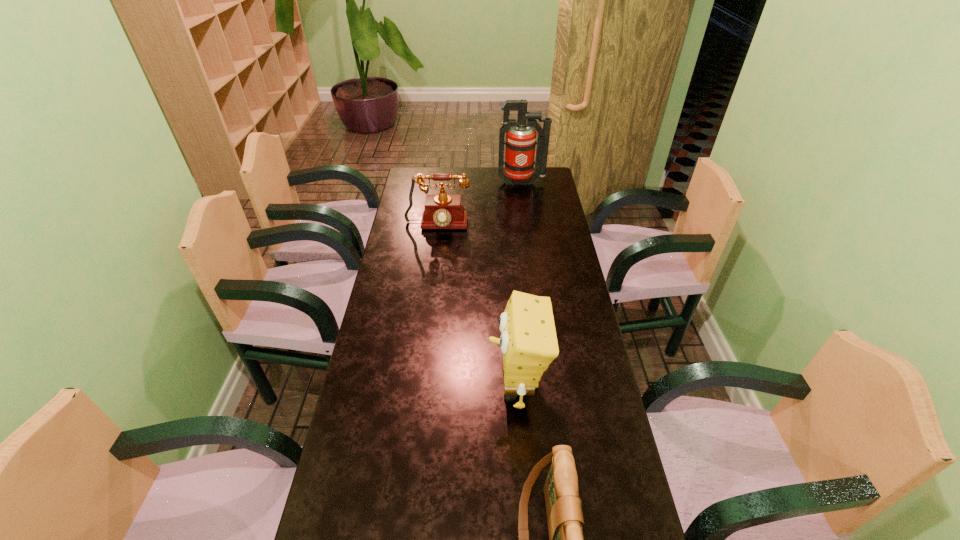
Where is `the farthest object`? Image resolution: width=960 pixels, height=540 pixels. the farthest object is located at coordinates (520, 142).

You are a GUI agent. You are given a task and a screenshot of the screen. Output one action in this format:
    pyautogui.click(x=<x>, y=<y>)
    Task: Click on the fire extinguisher
    
    Given the screenshot: What is the action you would take?
    pyautogui.click(x=520, y=142)

Where is `sponge`? sponge is located at coordinates (528, 342).

The image size is (960, 540). I want to click on the third shortest object, so click(528, 342).

This screenshot has height=540, width=960. I want to click on the third nearest object, so click(442, 211).

At what (x,y) coordinates should I click in order to perform the action: click on the leftmost object. Please return your answer as a coordinate pair (x, y). Looking at the image, I should click on (442, 211).

Where is `blank space located 0.050m on the front label side of the fire extinguisher`? Image resolution: width=960 pixels, height=540 pixels. blank space located 0.050m on the front label side of the fire extinguisher is located at coordinates (523, 195).

The width and height of the screenshot is (960, 540). What are the coordinates of `free space located 0.300m on the face of the third shortest object` in the screenshot? It's located at (385, 386).

This screenshot has width=960, height=540. I want to click on vacant space located 0.250m on the face of the third shortest object, so click(402, 386).

I want to click on vacant space situated 0.240m on the face of the third shortest object, so click(x=406, y=386).